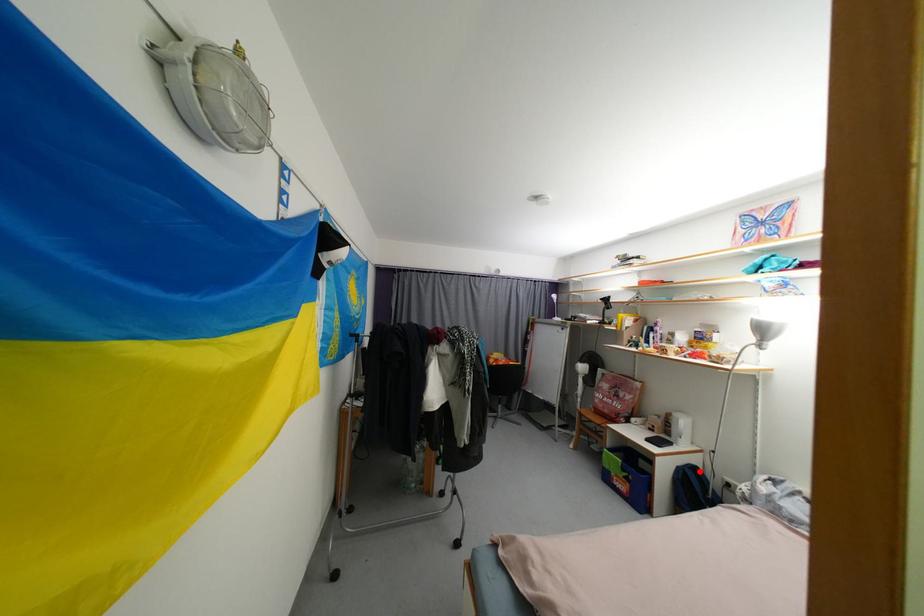
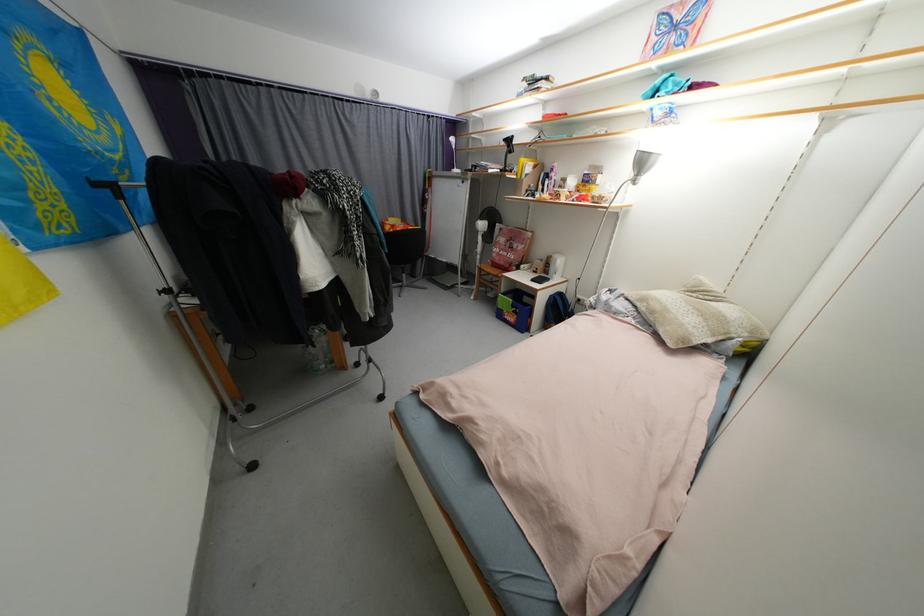
Question: I am providing you with two images of the same scene from different viewpoints. A red point is marked on the first image. Can you still see the location of the red point in image 2?

Choices:
 (A) Yes
 (B) No

Answer: (A)